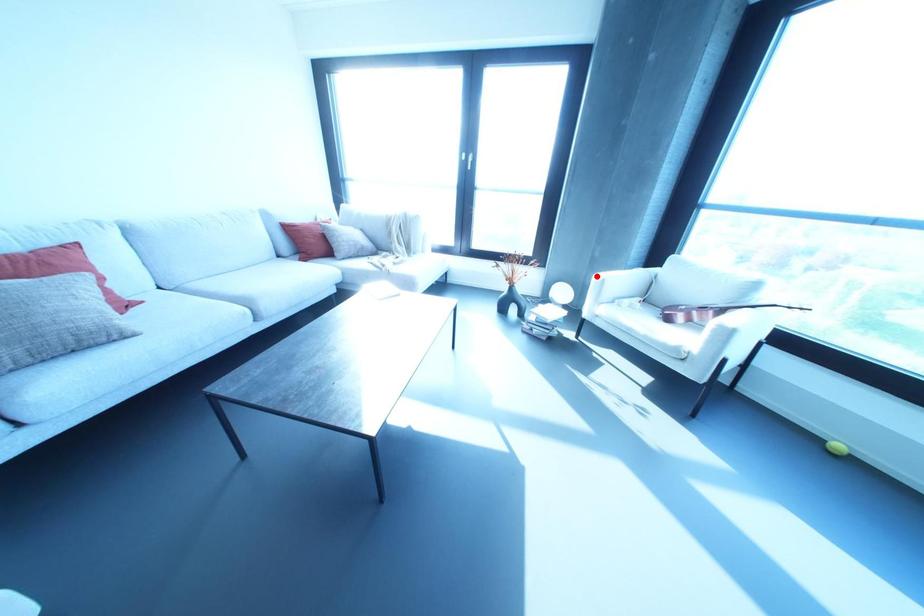
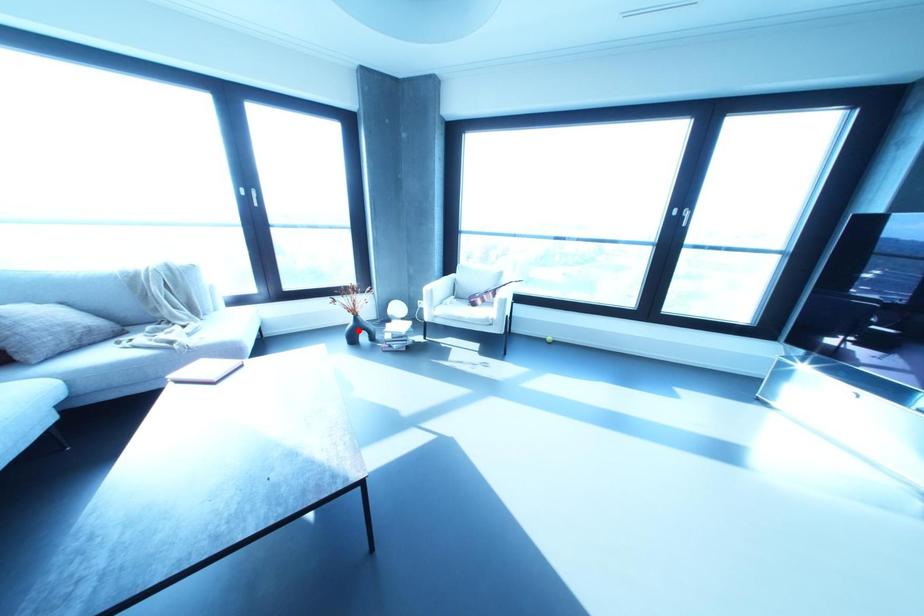
I am providing you with two images of the same scene from different viewpoints. A red point is marked on the first image and another point is marked on the second image. Do the highlighted points in image1 and image2 indicate the same real-world spot?

No